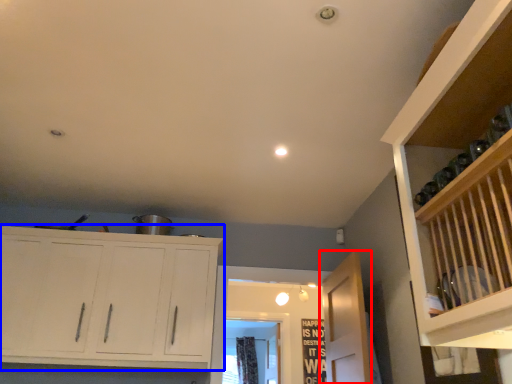
Question: Which object is closer to the camera taking this photo, door (highlighted by a red box) or cupboard (highlighted by a blue box)?

Choices:
 (A) door
 (B) cupboard

Answer: (A)